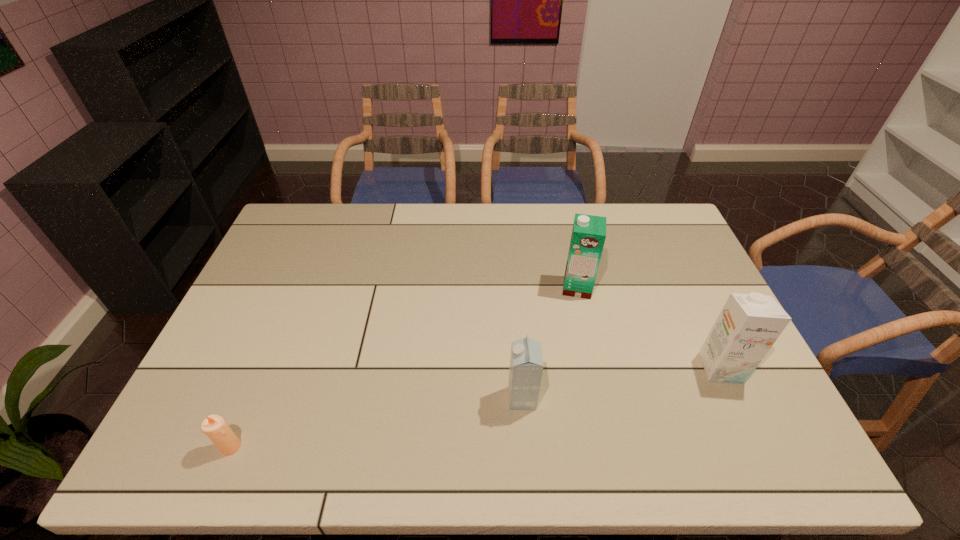
I want to click on vacant area situated on the front label of the leftmost carton, so 408,398.

In order to click on free point located on the front label of the leftmost carton in this screenshot , I will do `click(348, 398)`.

This screenshot has height=540, width=960. Identify the location of vacant space positioned on the front label of the leftmost carton. (485, 398).

The image size is (960, 540). In order to click on free space located 0.180m on the back of the shortest object in this screenshot , I will do `click(262, 372)`.

Image resolution: width=960 pixels, height=540 pixels. Find the location of `object present at the near edge`. object present at the near edge is located at coordinates click(214, 426).

You are a GUI agent. You are given a task and a screenshot of the screen. Output one action in this format:
    pyautogui.click(x=<x>, y=<y>)
    Task: Click on the object situated at the left edge
    The height and width of the screenshot is (540, 960).
    Given the screenshot: What is the action you would take?
    pyautogui.click(x=214, y=426)

Locate an element on the screen. object that is at the right edge is located at coordinates pos(749,324).

You are a GUI agent. You are given a task and a screenshot of the screen. Output one action in this format:
    pyautogui.click(x=<x>, y=<y>)
    Task: Click on the object at the near left corner
    
    Given the screenshot: What is the action you would take?
    pyautogui.click(x=214, y=426)

Where is `vacant space at the far edge`? This screenshot has height=540, width=960. vacant space at the far edge is located at coordinates (542, 217).

The image size is (960, 540). Identify the location of vacant space at the near edge of the desktop. (676, 446).